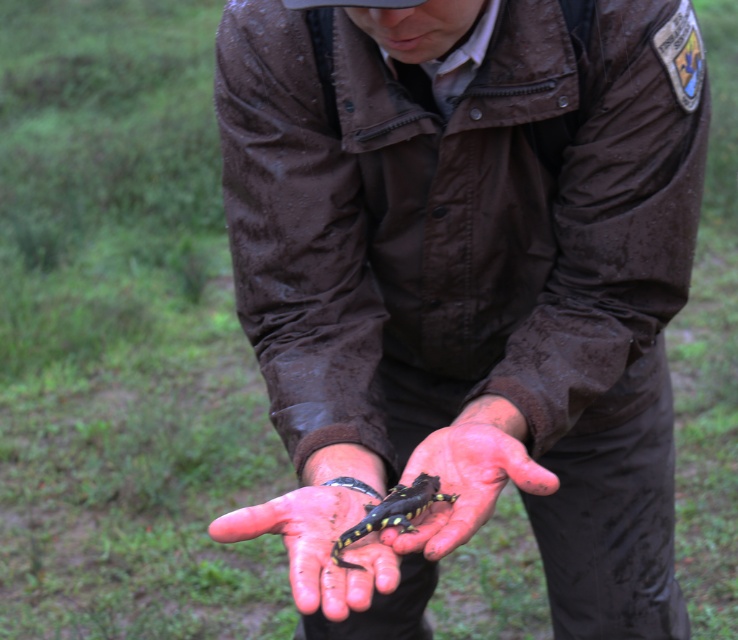
Looking at this image, can you confirm if brown leather jacket at center is positioned to the right of smooth skin hand at center?

Correct, you'll find brown leather jacket at center to the right of smooth skin hand at center.

Does point (379, 333) lie behind point (438, 458)?

Yes.

Which is in front, point (621, 362) or point (492, 512)?

Point (492, 512) is more forward.

This screenshot has width=738, height=640. Identify the location of brown leather jacket at center. coord(466,285).

Which of these two, brown leather jacket at center or yellow spotted lizard at center, stands taller?

brown leather jacket at center is taller.

Image resolution: width=738 pixels, height=640 pixels. Describe the element at coordinates (466, 285) in the screenshot. I see `brown leather jacket at center` at that location.

Where is `brown leather jacket at center`? The height and width of the screenshot is (640, 738). brown leather jacket at center is located at coordinates (466, 285).

Is yellow spotted lizard at center to the left of smooth skin hand at center from the viewer's perspective?

Yes, yellow spotted lizard at center is to the left of smooth skin hand at center.

Can you confirm if yellow spotted lizard at center is thinner than smooth skin hand at center?

Yes.

Describe the element at coordinates (317, 545) in the screenshot. I see `yellow spotted lizard at center` at that location.

Locate an element on the screen. This screenshot has width=738, height=640. yellow spotted lizard at center is located at coordinates (317, 545).